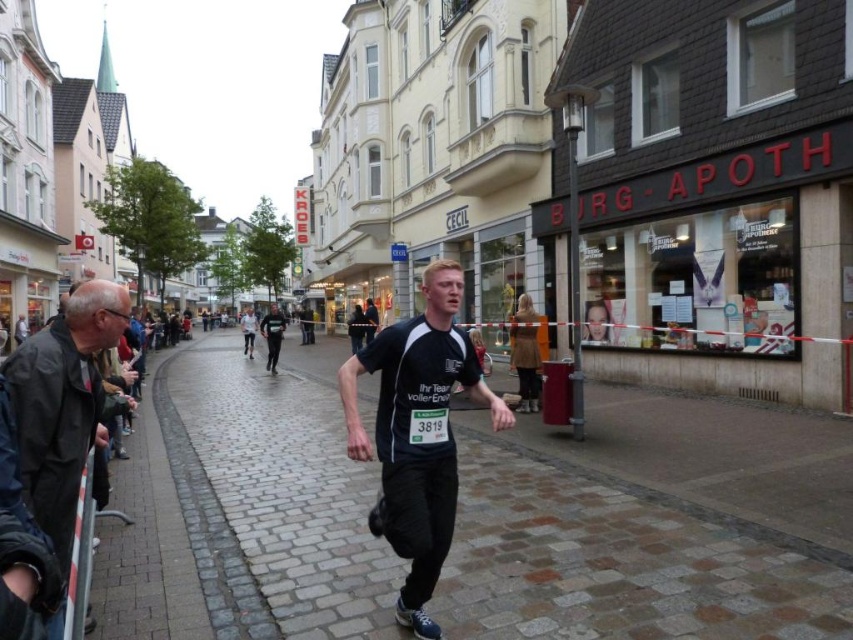
You are a photographer at the running event. You want to take a photo of the runner wearing the black matte running shirt at center and dark gray fabric jacket at center. Which piece of clothing takes up more area in the photo?

The dark gray fabric jacket at center takes up more area in the photo because the black matte running shirt at center occupies less space than the dark gray fabric jacket at center.

You are a participant in the running event and you see the black matte running shirt at center and the dark gray fabric jacket at center. Which one is closer to you?

The black matte running shirt at center and dark gray fabric jacket at center are 49.08 meters apart, so it is impossible to determine which one is closer without additional information about their positions relative to you.

You are a photographer positioned on the cobblestone street during the running event. You need to capture a clear photo of the black matte running shirt at center and the red plastic sign at center right. Which object should you zoom in on to ensure it appears larger in the photo?

The red plastic sign at center right is larger than the black matte running shirt at center, so you should zoom in on the red plastic sign at center right to ensure it appears larger in the photo.